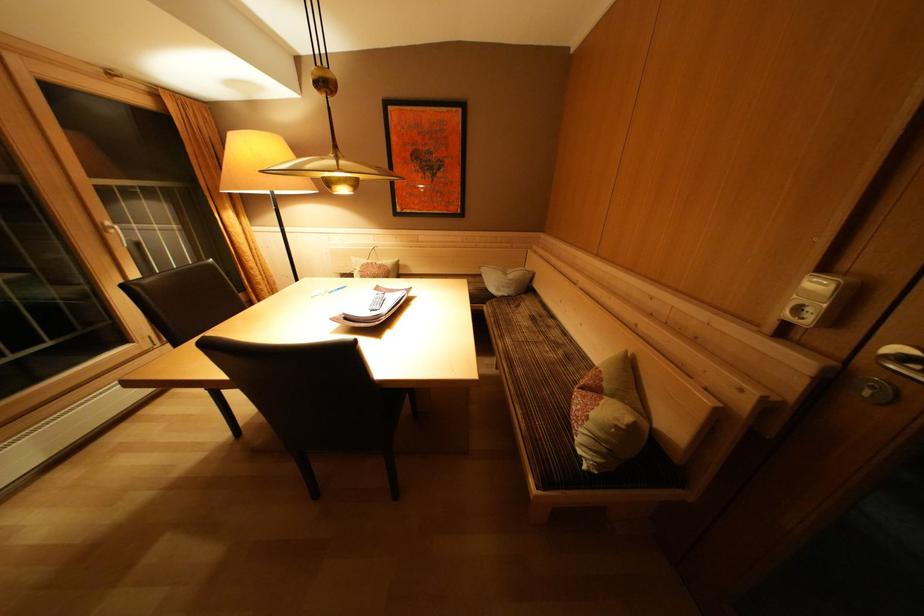
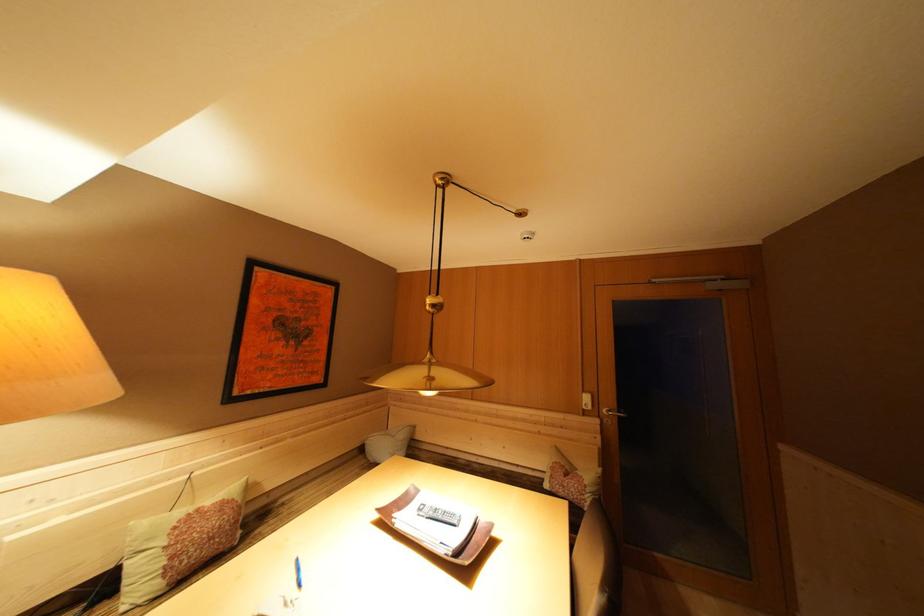
Locate, in the second image, the point that corresponds to pixel 600 419 in the first image.

(592, 487)